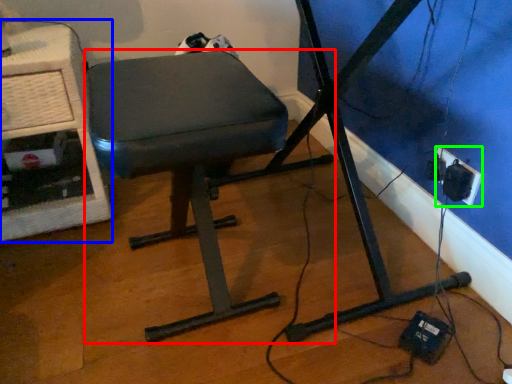
Question: Based on their relative distances, which object is nearer to furniture (highlighted by a red box)? Choose from computer desk (highlighted by a blue box) and electric outlet (highlighted by a green box).

Choices:
 (A) computer desk
 (B) electric outlet

Answer: (A)